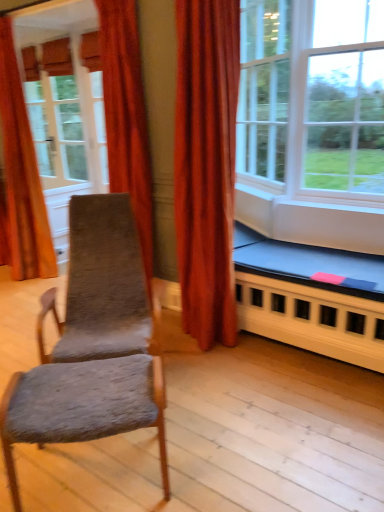
Locate an element on the screen. blue fabric bed frame at lower right is located at coordinates (310, 298).

Locate an element on the screen. white glass window at upper right, which appears as the first window when viewed from the left is located at coordinates (264, 88).

What do you see at coordinates (67, 125) in the screenshot? I see `matte white screen door at upper left` at bounding box center [67, 125].

Where is `blue fabric bed frame at lower right`? This screenshot has width=384, height=512. blue fabric bed frame at lower right is located at coordinates (310, 298).

Can you confirm if velvet orange curtain at left, which appears as the 2th curtain when viewed from the right, is shorter than textured gray fabric chair at center?

No, velvet orange curtain at left, which appears as the 2th curtain when viewed from the right, is not shorter than textured gray fabric chair at center.

What's the angular difference between velvet orange curtain at left, the first curtain in the back-to-front sequence, and textured gray fabric chair at center's facing directions?

velvet orange curtain at left, the first curtain in the back-to-front sequence, and textured gray fabric chair at center are facing 43.3 degrees away from each other.

Considering the positions of objects velvet orange curtain at left, which appears as the second curtain when viewed from the front, and textured gray fabric chair at center in the image provided, who is more to the left, velvet orange curtain at left, which appears as the second curtain when viewed from the front, or textured gray fabric chair at center?

velvet orange curtain at left, which appears as the second curtain when viewed from the front, is more to the left.

Locate an element on the screen. chair in front of the velvet orange curtain at left, the first curtain in the back-to-front sequence is located at coordinates (83, 406).

Is the depth of matte white screen door at upper left greater than that of velvet orange curtain at upper left, the 1th curtain in the front-to-back sequence?

Yes, matte white screen door at upper left is behind velvet orange curtain at upper left, the 1th curtain in the front-to-back sequence.

Is matte white screen door at upper left at the right side of velvet orange curtain at upper left, which is the 2th curtain in back-to-front order?

Incorrect, matte white screen door at upper left is not on the right side of velvet orange curtain at upper left, which is the 2th curtain in back-to-front order.

How many degrees apart are the facing directions of matte white screen door at upper left and velvet orange curtain at upper left, acting as the first curtain starting from the right?

The angle between the facing direction of matte white screen door at upper left and the facing direction of velvet orange curtain at upper left, acting as the first curtain starting from the right, is 89.6 degrees.

Is point (71, 103) closer or farther from the camera than point (142, 241)?

Clearly, point (71, 103) is more distant from the camera than point (142, 241).

Considering the positions of point (21, 372) and point (112, 249), is point (21, 372) closer or farther from the camera than point (112, 249)?

Point (21, 372) is positioned closer to the camera compared to point (112, 249).

Identify the location of rocking chair above the textured gray fabric chair at center (from a real-world perspective). This screenshot has width=384, height=512. (92, 345).

In the image, is textured gray fabric chair at center on the left side or the right side of textured gray fabric rocking chair at left?

textured gray fabric chair at center is to the right of textured gray fabric rocking chair at left.

Is white glass window at upper right, placed as the second window when sorted from right to left, not inside clear glass window at center, marked as the 1th window in a right-to-left arrangement?

No, white glass window at upper right, placed as the second window when sorted from right to left, is not outside of clear glass window at center, marked as the 1th window in a right-to-left arrangement.

Which of these two, white glass window at upper right, which appears as the first window when viewed from the left, or clear glass window at center, positioned as the 2th window in left-to-right order, stands taller?

Standing taller between the two is clear glass window at center, positioned as the 2th window in left-to-right order.

Between white glass window at upper right, which appears as the first window when viewed from the left, and clear glass window at center, positioned as the 2th window in left-to-right order, which one appears on the left side from the viewer's perspective?

white glass window at upper right, which appears as the first window when viewed from the left, is more to the left.

The image size is (384, 512). What are the coordinates of `window that appears behind the clear glass window at center, positioned as the 2th window in left-to-right order` in the screenshot? It's located at (264, 88).

Would you consider textured gray fabric rocking chair at left to be distant from velvet orange curtain at upper left, which is the 2th curtain in back-to-front order?

No.

Considering the positions of objects textured gray fabric rocking chair at left and velvet orange curtain at upper left, acting as the first curtain starting from the right, in the image provided, who is more to the right, textured gray fabric rocking chair at left or velvet orange curtain at upper left, acting as the first curtain starting from the right,?

textured gray fabric rocking chair at left.

Which is in front, point (87, 258) or point (149, 201)?

The point (87, 258) is closer.

Considering the relative sizes of clear glass window at center, positioned as the 2th window in left-to-right order, and matte white screen door at upper left in the image provided, is clear glass window at center, positioned as the 2th window in left-to-right order, bigger than matte white screen door at upper left?

Correct, clear glass window at center, positioned as the 2th window in left-to-right order, is larger in size than matte white screen door at upper left.

From the image's perspective, is clear glass window at center, marked as the 1th window in a right-to-left arrangement, over matte white screen door at upper left?

Actually, clear glass window at center, marked as the 1th window in a right-to-left arrangement, appears below matte white screen door at upper left in the image.

Looking at this image, is clear glass window at center, marked as the 1th window in a right-to-left arrangement, to the left or to the right of matte white screen door at upper left in the image?

clear glass window at center, marked as the 1th window in a right-to-left arrangement, is to the right of matte white screen door at upper left.

Considering the relative positions of clear glass window at center, positioned as the 2th window in left-to-right order, and matte white screen door at upper left in the image provided, is clear glass window at center, positioned as the 2th window in left-to-right order, behind matte white screen door at upper left?

No, the depth of clear glass window at center, positioned as the 2th window in left-to-right order, is less than that of matte white screen door at upper left.

In terms of width, does white glass window at upper right, which appears as the first window when viewed from the left, look wider or thinner when compared to matte white screen door at upper left?

Considering their sizes, white glass window at upper right, which appears as the first window when viewed from the left, looks slimmer than matte white screen door at upper left.

Based on the photo, is white glass window at upper right, placed as the second window when sorted from right to left, in front of or behind matte white screen door at upper left in the image?

Visually, white glass window at upper right, placed as the second window when sorted from right to left, is located in front of matte white screen door at upper left.

Would you say white glass window at upper right, placed as the second window when sorted from right to left, is inside or outside matte white screen door at upper left?

white glass window at upper right, placed as the second window when sorted from right to left, is outside matte white screen door at upper left.

From the image's perspective, which one is positioned lower, white glass window at upper right, which appears as the first window when viewed from the left, or matte white screen door at upper left?

white glass window at upper right, which appears as the first window when viewed from the left, is shown below in the image.

Image resolution: width=384 pixels, height=512 pixels. I want to click on chair lying on the right of velvet orange curtain at left, which appears as the 2th curtain when viewed from the right, so click(83, 406).

I want to click on screen door behind the velvet orange curtain at upper left, which is the 2th curtain in back-to-front order, so [x=67, y=125].

From the image, which object appears to be nearer to velvet orange curtain at upper left, which is the second curtain from left to right, white glass window at upper right, which appears as the first window when viewed from the left, or matte white screen door at upper left?

Among the two, white glass window at upper right, which appears as the first window when viewed from the left, is located nearer to velvet orange curtain at upper left, which is the second curtain from left to right.

From the image, which object appears to be nearer to textured gray fabric rocking chair at left, matte white screen door at upper left or blue fabric bed frame at lower right?

blue fabric bed frame at lower right.

When comparing their distances from velvet orange curtain at left, positioned as the 1th curtain in left-to-right order, does blue fabric bed frame at lower right or clear glass window at center, positioned as the 2th window in left-to-right order, seem closer?

Based on the image, clear glass window at center, positioned as the 2th window in left-to-right order, appears to be nearer to velvet orange curtain at left, positioned as the 1th curtain in left-to-right order.

Based on their spatial positions, is velvet orange curtain at upper left, acting as the first curtain starting from the right, or textured gray fabric chair at center closer to velvet orange curtain at left, which appears as the 2th curtain when viewed from the right?

Based on the image, velvet orange curtain at upper left, acting as the first curtain starting from the right, appears to be nearer to velvet orange curtain at left, which appears as the 2th curtain when viewed from the right.

Looking at the image, which one is located further to velvet orange curtain at upper left, acting as the first curtain starting from the right, blue fabric bed frame at lower right or textured gray fabric rocking chair at left?

blue fabric bed frame at lower right is positioned further to the anchor velvet orange curtain at upper left, acting as the first curtain starting from the right.

Considering their positions, is textured gray fabric chair at center positioned further to blue fabric bed frame at lower right than velvet orange curtain at upper left, acting as the first curtain starting from the right?

The object further to blue fabric bed frame at lower right is textured gray fabric chair at center.

Considering their positions, is textured gray fabric rocking chair at left positioned closer to blue fabric bed frame at lower right than velvet orange curtain at upper left, the 1th curtain in the front-to-back sequence?

Based on the image, textured gray fabric rocking chair at left appears to be nearer to blue fabric bed frame at lower right.

Based on their spatial positions, is matte white screen door at upper left or velvet orange curtain at upper left, acting as the first curtain starting from the right, closer to textured gray fabric rocking chair at left?

Based on the image, velvet orange curtain at upper left, acting as the first curtain starting from the right, appears to be nearer to textured gray fabric rocking chair at left.

The image size is (384, 512). Identify the location of rocking chair located between clear glass window at center, marked as the 1th window in a right-to-left arrangement, and matte white screen door at upper left in the depth direction. (92, 345).

At what (x,y) coordinates should I click in order to perform the action: click on rocking chair between velvet orange curtain at left, positioned as the 1th curtain in left-to-right order, and blue fabric bed frame at lower right from left to right. Please return your answer as a coordinate pair (x, y). The height and width of the screenshot is (512, 384). Looking at the image, I should click on (92, 345).

At what (x,y) coordinates should I click in order to perform the action: click on rocking chair situated between velvet orange curtain at upper left, the 1th curtain in the front-to-back sequence, and blue fabric bed frame at lower right from left to right. Please return your answer as a coordinate pair (x, y). Image resolution: width=384 pixels, height=512 pixels. Looking at the image, I should click on (92, 345).

Find the location of a particular element. The width and height of the screenshot is (384, 512). window between velvet orange curtain at left, which appears as the 2th curtain when viewed from the right, and clear glass window at center, marked as the 1th window in a right-to-left arrangement, from left to right is located at coordinates (x=264, y=88).